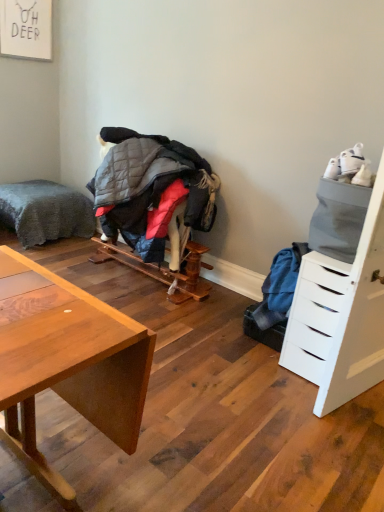
Question: Is gray plush bed at left located outside quilted gray jacket at center?

Choices:
 (A) yes
 (B) no

Answer: (A)

Question: From a real-world perspective, is gray plush bed at left under quilted gray jacket at center?

Choices:
 (A) yes
 (B) no

Answer: (A)

Question: Is gray plush bed at left not close to quilted gray jacket at center?

Choices:
 (A) no
 (B) yes

Answer: (B)

Question: From the image's perspective, is gray plush bed at left located beneath quilted gray jacket at center?

Choices:
 (A) yes
 (B) no

Answer: (B)

Question: Are gray plush bed at left and quilted gray jacket at center making contact?

Choices:
 (A) yes
 (B) no

Answer: (B)

Question: In terms of width, does white matte drawer at right look wider or thinner when compared to quilted gray jacket at center?

Choices:
 (A) wide
 (B) thin

Answer: (A)

Question: Relative to quilted gray jacket at center, is white matte drawer at right in front or behind?

Choices:
 (A) front
 (B) behind

Answer: (A)

Question: From the image's perspective, relative to quilted gray jacket at center, is white matte drawer at right above or below?

Choices:
 (A) below
 (B) above

Answer: (A)

Question: In terms of height, does white matte drawer at right look taller or shorter compared to quilted gray jacket at center?

Choices:
 (A) tall
 (B) short

Answer: (A)

Question: Considering the positions of white matte drawer at right and gray plush bed at left in the image, is white matte drawer at right wider or thinner than gray plush bed at left?

Choices:
 (A) wide
 (B) thin

Answer: (B)

Question: From the image's perspective, relative to gray plush bed at left, is white matte drawer at right above or below?

Choices:
 (A) above
 (B) below

Answer: (B)

Question: Would you say white matte drawer at right is to the left or to the right of gray plush bed at left in the picture?

Choices:
 (A) left
 (B) right

Answer: (B)

Question: Is point (332, 321) closer or farther from the camera than point (84, 216)?

Choices:
 (A) farther
 (B) closer

Answer: (B)

Question: In terms of height, does quilted gray jacket at center look taller or shorter compared to gray plush bed at left?

Choices:
 (A) tall
 (B) short

Answer: (A)

Question: Looking at the image, does quilted gray jacket at center seem bigger or smaller compared to gray plush bed at left?

Choices:
 (A) big
 (B) small

Answer: (B)